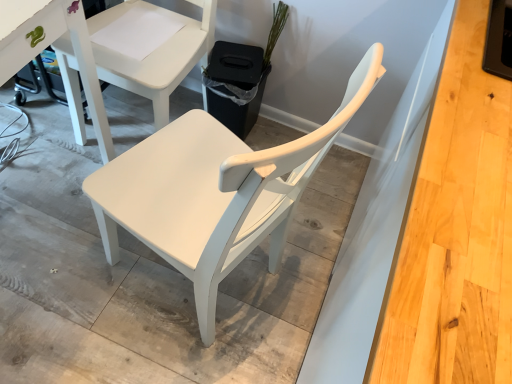
Question: Is green matte plant at upper center in front of white matte chair at center, which is the 2th chair from bottom to top?

Choices:
 (A) yes
 (B) no

Answer: (B)

Question: Is green matte plant at upper center to the right of white matte chair at center, which is the 2th chair from bottom to top, from the viewer's perspective?

Choices:
 (A) no
 (B) yes

Answer: (B)

Question: Considering the relative sizes of green matte plant at upper center and white matte chair at center, which is counted as the first chair, starting from the top, in the image provided, is green matte plant at upper center smaller than white matte chair at center, which is counted as the first chair, starting from the top,?

Choices:
 (A) yes
 (B) no

Answer: (A)

Question: From the image's perspective, would you say green matte plant at upper center is positioned over white matte chair at center, which is counted as the first chair, starting from the top?

Choices:
 (A) yes
 (B) no

Answer: (A)

Question: Does green matte plant at upper center have a lesser width compared to white matte chair at center, which is counted as the first chair, starting from the top?

Choices:
 (A) no
 (B) yes

Answer: (B)

Question: Relative to white matte chair at center, positioned as the 2th chair in top-to-bottom order, is green matte plant at upper center in front or behind?

Choices:
 (A) front
 (B) behind

Answer: (B)

Question: Considering the positions of green matte plant at upper center and white matte chair at center, positioned as the 2th chair in top-to-bottom order, in the image, is green matte plant at upper center bigger or smaller than white matte chair at center, positioned as the 2th chair in top-to-bottom order,?

Choices:
 (A) big
 (B) small

Answer: (B)

Question: Is green matte plant at upper center inside or outside of white matte chair at center, positioned as the 2th chair in top-to-bottom order?

Choices:
 (A) inside
 (B) outside

Answer: (B)

Question: Considering the positions of green matte plant at upper center and white matte chair at center, positioned as the 2th chair in top-to-bottom order, in the image, is green matte plant at upper center taller or shorter than white matte chair at center, positioned as the 2th chair in top-to-bottom order,?

Choices:
 (A) tall
 (B) short

Answer: (A)

Question: Is green matte plant at upper center in front of or behind white matte chair at center, which is counted as the first chair, starting from the top, in the image?

Choices:
 (A) behind
 (B) front

Answer: (A)

Question: Based on their positions, is green matte plant at upper center located to the left or right of white matte chair at center, which is the 2th chair from bottom to top?

Choices:
 (A) left
 (B) right

Answer: (B)

Question: Is green matte plant at upper center inside the boundaries of white matte chair at center, which is counted as the first chair, starting from the top, or outside?

Choices:
 (A) outside
 (B) inside

Answer: (A)

Question: Is point (269, 29) closer or farther from the camera than point (163, 59)?

Choices:
 (A) closer
 (B) farther

Answer: (B)

Question: From the image's perspective, is white matte chair at center, marked as the first chair in a bottom-to-top arrangement, positioned above or below white matte chair at center, which is counted as the first chair, starting from the top?

Choices:
 (A) below
 (B) above

Answer: (A)

Question: In terms of size, does white matte chair at center, marked as the first chair in a bottom-to-top arrangement, appear bigger or smaller than white matte chair at center, which is counted as the first chair, starting from the top?

Choices:
 (A) big
 (B) small

Answer: (B)